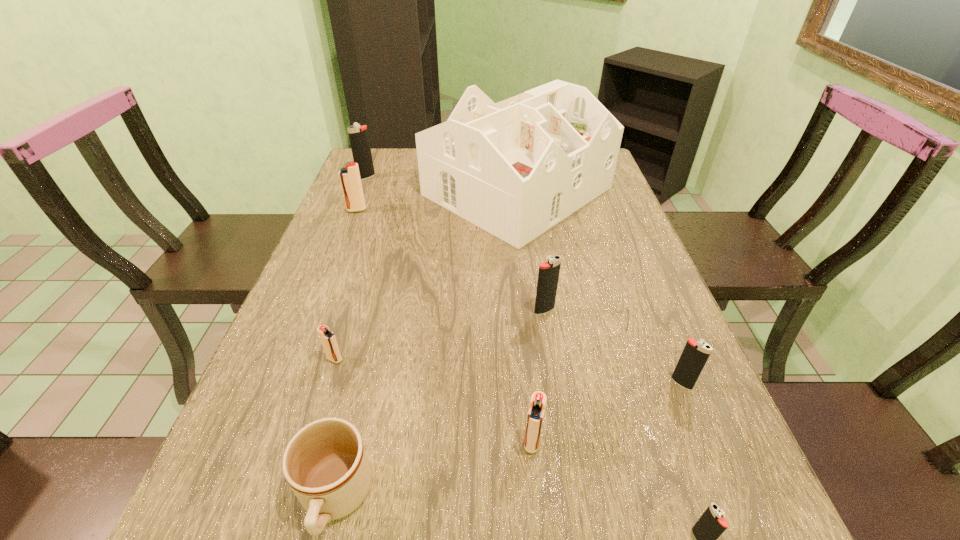
The height and width of the screenshot is (540, 960). What are the coordinates of `vacant area situated 0.080m on the left of the fourth nearest igniter` in the screenshot? It's located at (287, 359).

Find the location of a particular element. The width and height of the screenshot is (960, 540). dollhouse that is at the far edge is located at coordinates (516, 168).

This screenshot has height=540, width=960. I want to click on igniter that is positioned at the far edge, so click(x=358, y=135).

The image size is (960, 540). In order to click on dollhouse present at the right edge in this screenshot , I will do `click(516, 168)`.

Locate an element on the screen. The height and width of the screenshot is (540, 960). igniter located at the right edge is located at coordinates (695, 354).

You are a GUI agent. You are given a task and a screenshot of the screen. Output one action in this format:
    pyautogui.click(x=<x>, y=<y>)
    Task: Click on the object located at the far left corner
    The image size is (960, 540).
    Given the screenshot: What is the action you would take?
    pyautogui.click(x=358, y=135)

At what (x,y) coordinates should I click in order to perform the action: click on object positioned at the far right corner. Please return your answer as a coordinate pair (x, y). Looking at the image, I should click on (516, 168).

I want to click on vacant space at the near edge of the desktop, so click(x=581, y=529).

The height and width of the screenshot is (540, 960). In the image, there is a desktop. What are the coordinates of `vacant space at the left edge` in the screenshot? It's located at (378, 233).

Find the location of a particular element. vacant region at the right edge of the desktop is located at coordinates (599, 239).